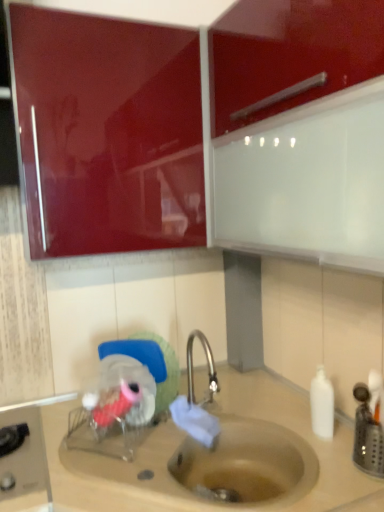
Question: Does beige matte sink at lower center have a larger size compared to glossy red cabinet at upper left?

Choices:
 (A) no
 (B) yes

Answer: (B)

Question: From a real-world perspective, is beige matte sink at lower center below glossy red cabinet at upper left?

Choices:
 (A) no
 (B) yes

Answer: (B)

Question: From a real-world perspective, is beige matte sink at lower center on glossy red cabinet at upper left?

Choices:
 (A) yes
 (B) no

Answer: (B)

Question: From the image's perspective, is beige matte sink at lower center under glossy red cabinet at upper left?

Choices:
 (A) no
 (B) yes

Answer: (B)

Question: Is beige matte sink at lower center not close to glossy red cabinet at upper left?

Choices:
 (A) no
 (B) yes

Answer: (A)

Question: Does beige matte sink at lower center have a lesser height compared to glossy red cabinet at upper left?

Choices:
 (A) yes
 (B) no

Answer: (B)

Question: Considering the relative sizes of white matte bottle at right and glossy red cabinet at upper left in the image provided, is white matte bottle at right shorter than glossy red cabinet at upper left?

Choices:
 (A) no
 (B) yes

Answer: (B)

Question: Could glossy red cabinet at upper left be considered to be inside white matte bottle at right?

Choices:
 (A) no
 (B) yes

Answer: (A)

Question: Can you confirm if white matte bottle at right is positioned to the left of glossy red cabinet at upper left?

Choices:
 (A) no
 (B) yes

Answer: (A)

Question: From the image's perspective, is white matte bottle at right below glossy red cabinet at upper left?

Choices:
 (A) no
 (B) yes

Answer: (B)

Question: From a real-world perspective, is white matte bottle at right over glossy red cabinet at upper left?

Choices:
 (A) yes
 (B) no

Answer: (B)

Question: Are white matte bottle at right and glossy red cabinet at upper left beside each other?

Choices:
 (A) yes
 (B) no

Answer: (B)

Question: Is glossy red cabinet at upper left next to beige matte sink at lower center and touching it?

Choices:
 (A) yes
 (B) no

Answer: (B)